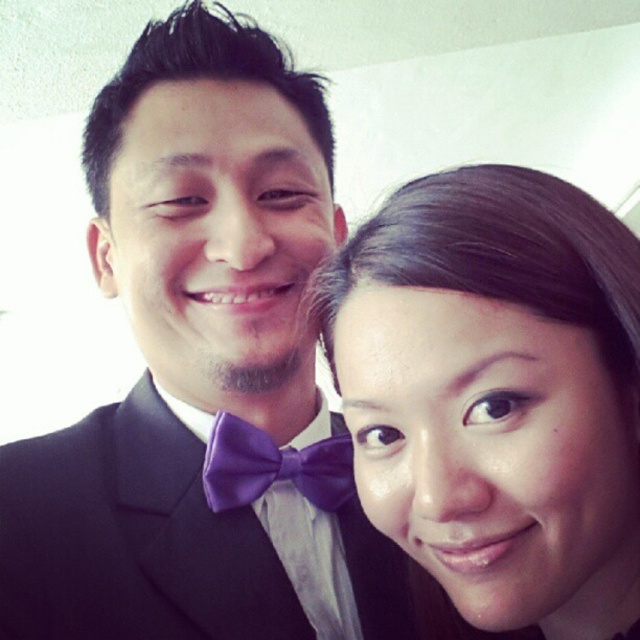
Question: Is matte black suit at center thinner than purple satin bow tie at center?

Choices:
 (A) yes
 (B) no

Answer: (B)

Question: Can you confirm if smooth skin face at right is bigger than matte black suit at center?

Choices:
 (A) yes
 (B) no

Answer: (A)

Question: Estimate the real-world distances between objects in this image. Which object is closer to the smooth skin face at right?

Choices:
 (A) purple satin bow tie at center
 (B) matte black suit at center

Answer: (A)

Question: Which is farther from the smooth skin face at right?

Choices:
 (A) matte black suit at center
 (B) purple satin bow tie at center

Answer: (A)

Question: Which object appears farthest from the camera in this image?

Choices:
 (A) matte black suit at center
 (B) purple satin bow tie at center
 (C) smooth skin face at right

Answer: (B)

Question: Is smooth skin face at right bigger than matte black suit at center?

Choices:
 (A) no
 (B) yes

Answer: (B)